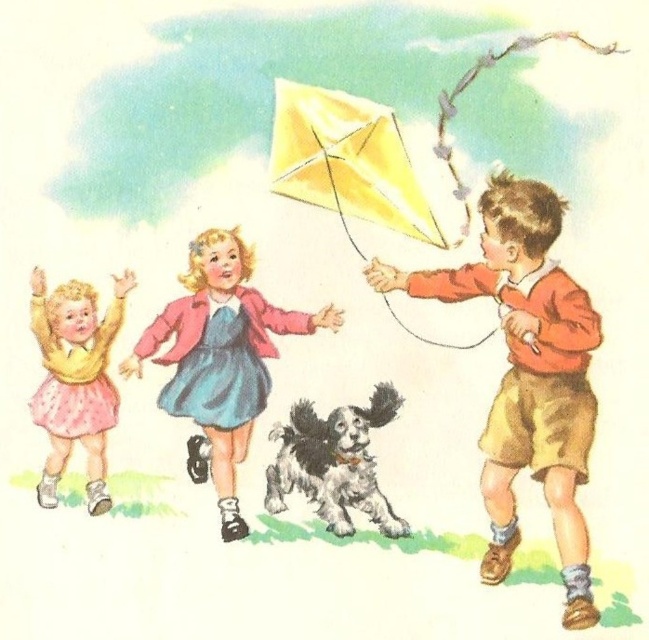
Question: Can you confirm if matte pink dress at center is positioned below fluffy white dog at center?

Choices:
 (A) no
 (B) yes

Answer: (A)

Question: Does matte orange sweater at right appear on the left side of pink matte skirt at lower left?

Choices:
 (A) no
 (B) yes

Answer: (A)

Question: Estimate the real-world distances between objects in this image. Which object is closer to the pink matte skirt at lower left?

Choices:
 (A) matte orange sweater at right
 (B) fluffy white dog at center
 (C) yellow paper kite at upper center
 (D) matte pink dress at center

Answer: (D)

Question: Is matte pink dress at center to the left of pink matte skirt at lower left from the viewer's perspective?

Choices:
 (A) no
 (B) yes

Answer: (A)

Question: Estimate the real-world distances between objects in this image. Which object is closer to the fluffy white dog at center?

Choices:
 (A) matte orange sweater at right
 (B) matte pink dress at center
 (C) pink matte skirt at lower left
 (D) yellow paper kite at upper center

Answer: (B)

Question: Which is nearer to the matte pink dress at center?

Choices:
 (A) fluffy white dog at center
 (B) yellow paper kite at upper center
 (C) matte orange sweater at right
 (D) pink matte skirt at lower left

Answer: (D)